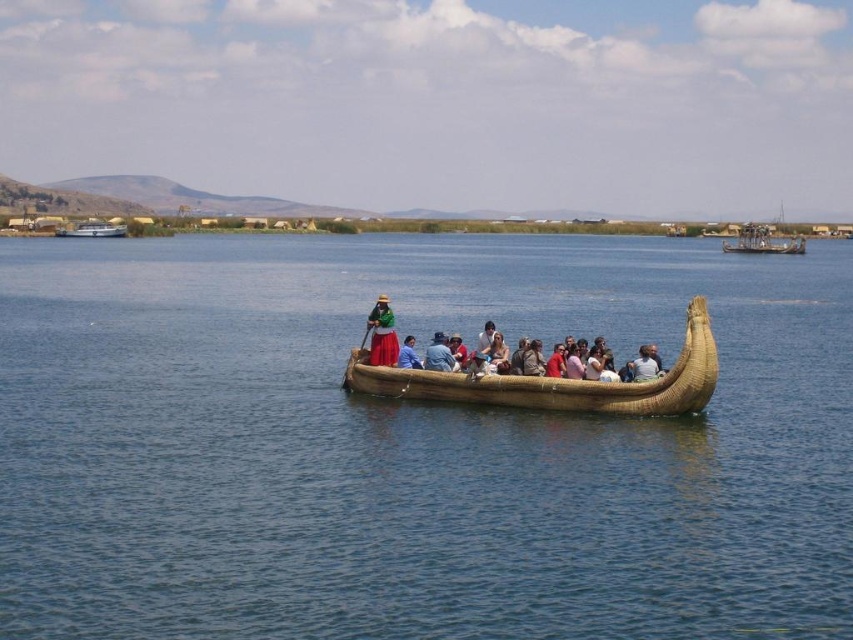
Can you confirm if green woven fabric at center is smaller than white glossy boat at upper left?

Yes.

Who is more forward, (374, 349) or (115, 220)?

Point (374, 349) is in front.

Between point (376, 332) and point (106, 221), which one is positioned in front?

Point (376, 332) is in front.

This screenshot has width=853, height=640. What are the coordinates of `green woven fabric at center` in the screenshot? It's located at (381, 333).

Can you confirm if brown woven boat at center is smaller than white glossy boat at upper left?

No.

Measure the distance between brown woven boat at center and white glossy boat at upper left.

brown woven boat at center and white glossy boat at upper left are 93.79 meters apart.

Which is behind, point (67, 252) or point (86, 228)?

Point (86, 228)

This screenshot has height=640, width=853. Identify the location of brown woven boat at center. (413, 444).

Between matte brown boat at center and blue fabric at center, which one has less height?

With less height is blue fabric at center.

Does matte brown boat at center appear under blue fabric at center?

Actually, matte brown boat at center is above blue fabric at center.

Is point (461, 355) in front of point (413, 355)?

No, it is not.

Where is `matte brown boat at center`? matte brown boat at center is located at coordinates (451, 349).